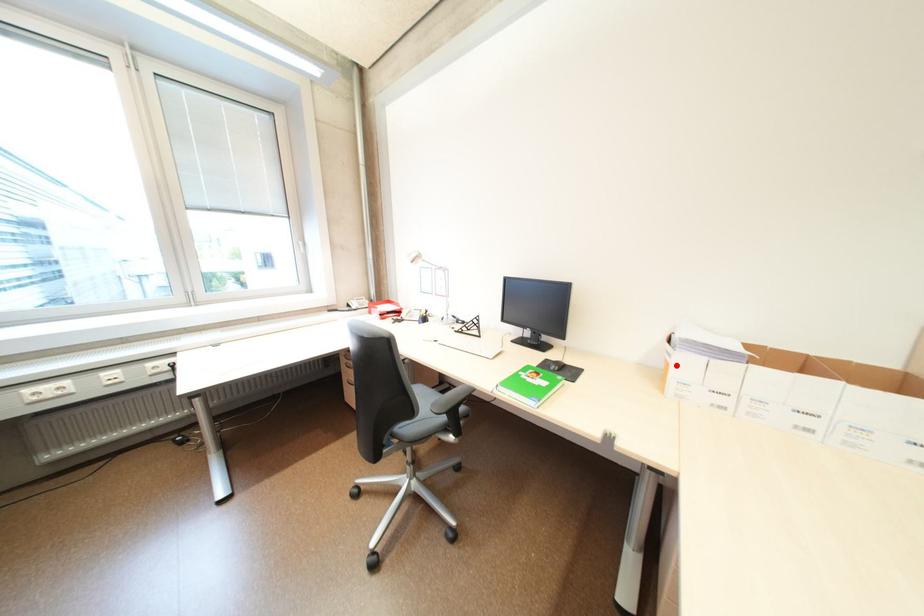
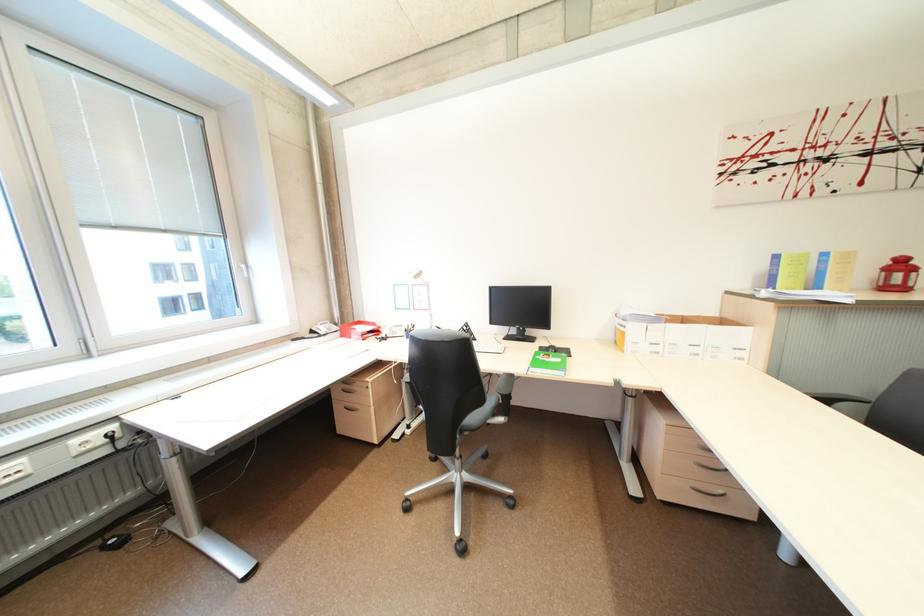
Question: A red point is marked in image1. In image2, is the corresponding 3D point closer to the camera or farther? Reply with the corresponding letter.

Choices:
 (A) The corresponding 3D point is closer.
 (B) The corresponding 3D point is farther.

Answer: (A)